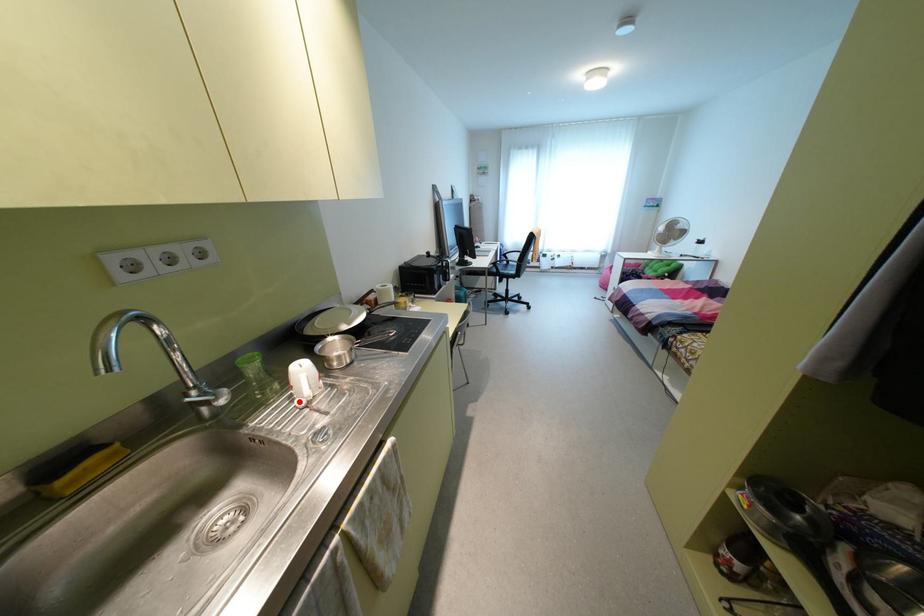
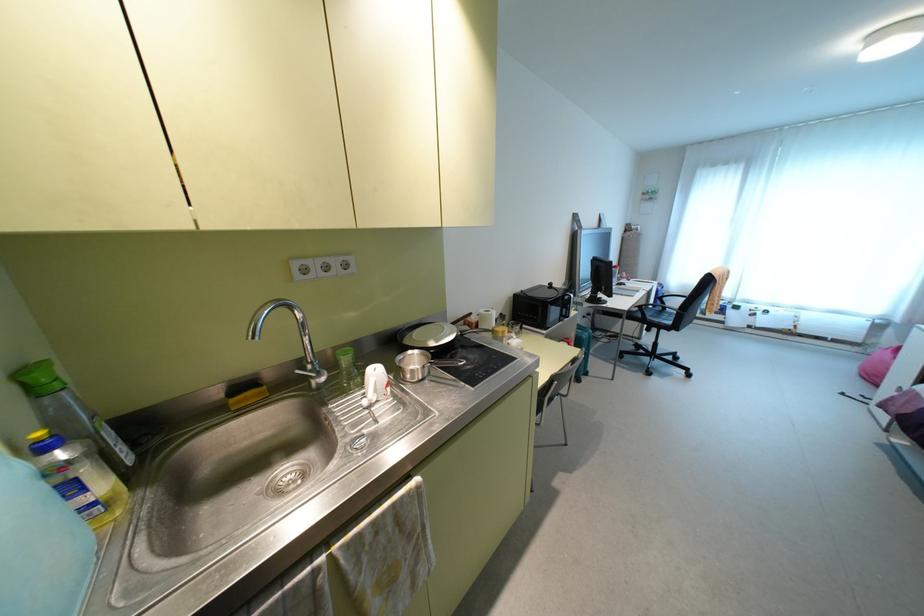
Question: I am providing you with two images of the same scene from different viewpoints. A red point is marked on the first image. Can you still see the location of the red point in image 2?

Choices:
 (A) Yes
 (B) No

Answer: (A)